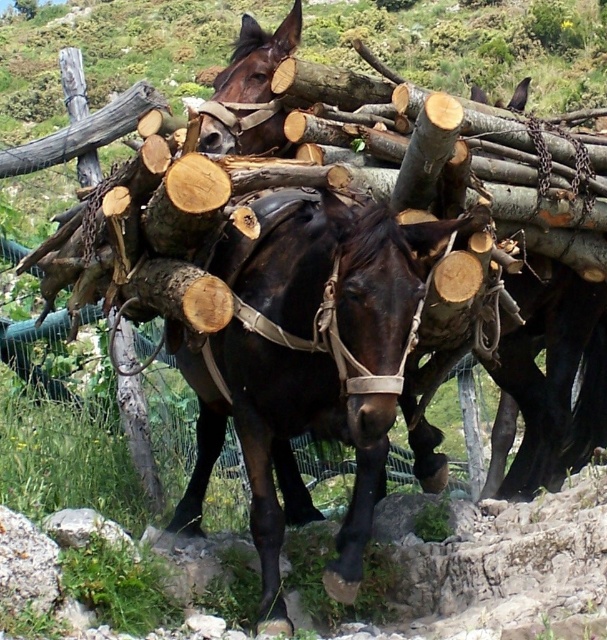
You are a farmer checking the load on your horses. You notice the brown leather harness at center and the shiny brown horse at center. Which object is taller?

The brown leather harness at center is taller than the shiny brown horse at center.

You are standing in a field and see a point marked at coordinates (x=446, y=124). You want to throw a ball to hit that point. If the maximum distance you can throw is 3.79 meters, will you be able to reach it?

The point at (x=446, y=124) is exactly 3.79 meters away from you, so yes, you can reach it with your maximum throw distance of 3.79 meters.

You are a farmer inspecting the equipment on your horses. You notice the brown leather harness at center and the shiny brown horse at center. Which object is positioned closer to you?

The brown leather harness at center is closer to the viewer than the shiny brown horse at center.